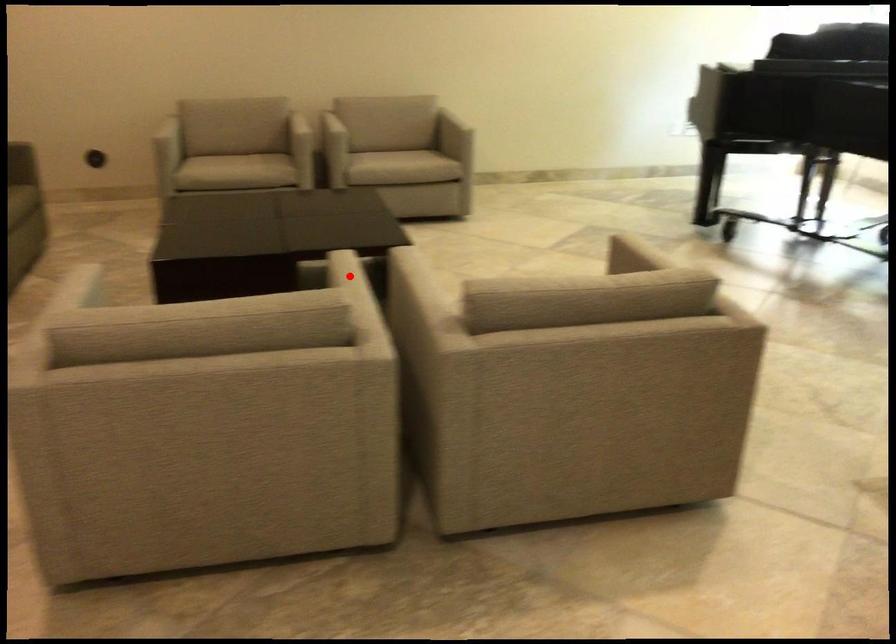
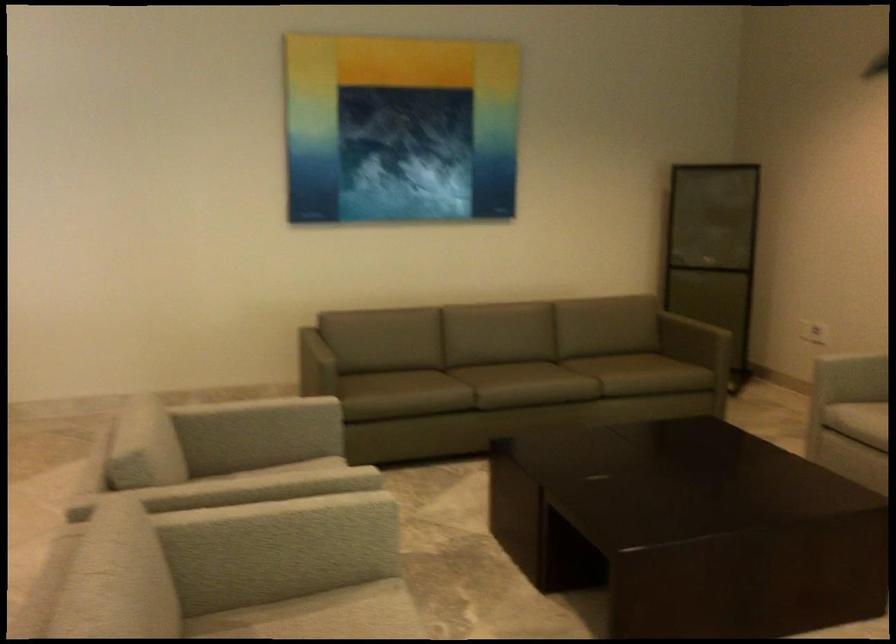
Where in the second image is the point corresponding to the highlighted location from the first image?

(254, 484)